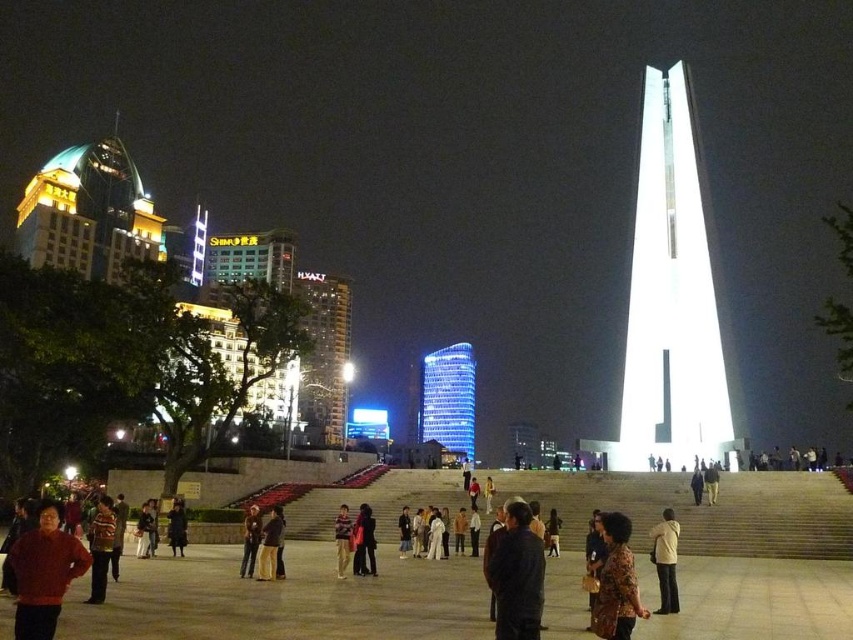
Can you confirm if matte gold building at left is shorter than dark matte coat at lower left?

In fact, matte gold building at left may be taller than dark matte coat at lower left.

Is matte gold building at left above dark matte coat at lower left?

Correct, matte gold building at left is located above dark matte coat at lower left.

Does point (140, 196) come behind point (172, 513)?

Yes, it is.

Locate an element on the screen. The height and width of the screenshot is (640, 853). matte gold building at left is located at coordinates (88, 212).

Is white glossy tower at center below light brown leather jacket at lower center?

No.

Who is taller, white glossy tower at center or light brown leather jacket at lower center?

Standing taller between the two is white glossy tower at center.

The image size is (853, 640). I want to click on white glossy tower at center, so click(x=672, y=300).

The width and height of the screenshot is (853, 640). Identify the location of white glossy tower at center. (672, 300).

Does point (103, 522) lie behind point (340, 522)?

No, it is in front of (340, 522).

Does striped sweater at lower left have a larger size compared to brown leather jacket at center?

Indeed, striped sweater at lower left has a larger size compared to brown leather jacket at center.

Does point (96, 572) lie in front of point (339, 518)?

Yes, point (96, 572) is in front of point (339, 518).

Where is `striped sweater at lower left`? This screenshot has width=853, height=640. striped sweater at lower left is located at coordinates (100, 547).